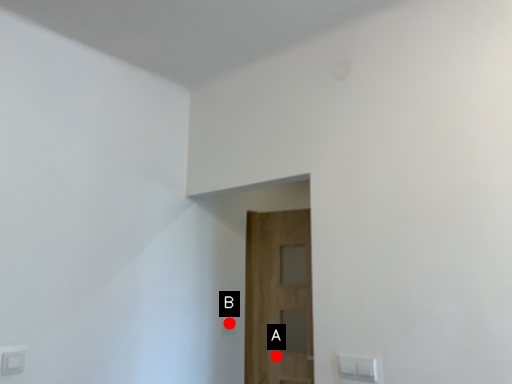
Question: Two points are circled on the image, labeled by A and B beside each circle. Which point is farther from the camera taking this photo?

Choices:
 (A) A is further
 (B) B is further

Answer: (A)